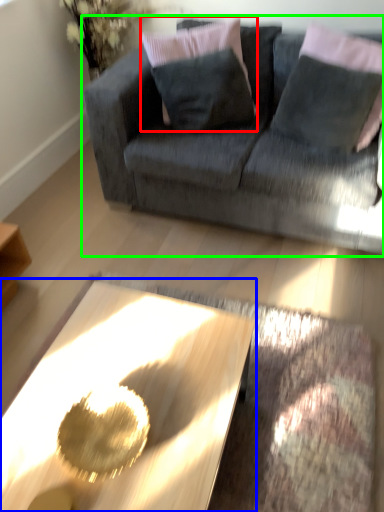
Question: Which object is the farthest from pillow (highlighted by a red box)? Choose among these: coffee table (highlighted by a blue box) or studio couch (highlighted by a green box).

Choices:
 (A) coffee table
 (B) studio couch

Answer: (A)